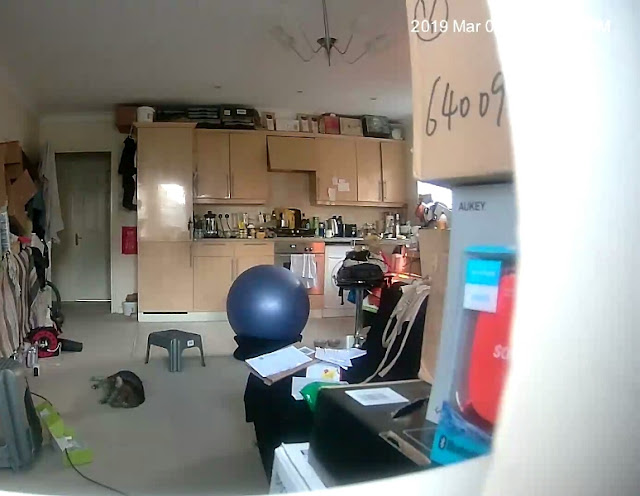
At what (x,y) coordinates should I click in order to perform the action: click on kitchen counter clutter. Please return your answer as a coordinate pair (x, y). The height and width of the screenshot is (496, 640). Looking at the image, I should click on (212, 229), (246, 228), (290, 223), (329, 229), (364, 230), (396, 223).